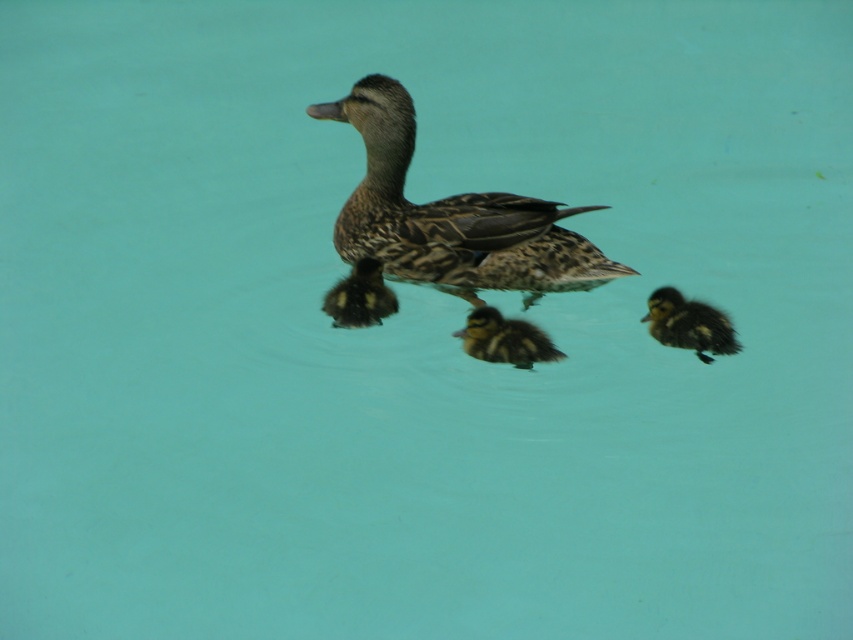
Between fluffy brown duckling at right and soft brown downy duckling at center, which one is positioned lower?

fluffy brown duckling at right is below.

Can you confirm if fluffy brown duckling at right is thinner than soft brown downy duckling at center?

No.

The width and height of the screenshot is (853, 640). Describe the element at coordinates (688, 324) in the screenshot. I see `fluffy brown duckling at right` at that location.

Image resolution: width=853 pixels, height=640 pixels. In order to click on fluffy brown duckling at right in this screenshot , I will do `click(688, 324)`.

Is fluffy brown duckling at right taller than brown fluffy duckling at center?

Yes.

Is fluffy brown duckling at right closer to camera compared to brown fluffy duckling at center?

Yes, fluffy brown duckling at right is closer to the viewer.

Does point (692, 321) come farther from viewer compared to point (469, 340)?

No, (692, 321) is closer to viewer.

Find the location of `fluffy brown duckling at right`. fluffy brown duckling at right is located at coordinates (688, 324).

Which of these two, brown speckled duckling at center or fluffy brown duckling at right, stands shorter?

fluffy brown duckling at right is shorter.

Is point (376, 113) positioned in front of point (660, 337)?

No, (376, 113) is behind (660, 337).

Is point (593, 252) positioned behind point (693, 323)?

Yes, point (593, 252) is behind point (693, 323).

Where is `brown speckled duckling at center`? This screenshot has width=853, height=640. brown speckled duckling at center is located at coordinates (451, 216).